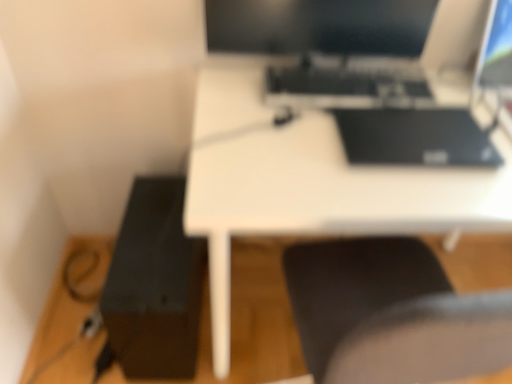
Locate an element on the screen. The image size is (512, 384). empty space that is ontop of white matte desk at center (from a real-world perspective) is located at coordinates (384, 140).